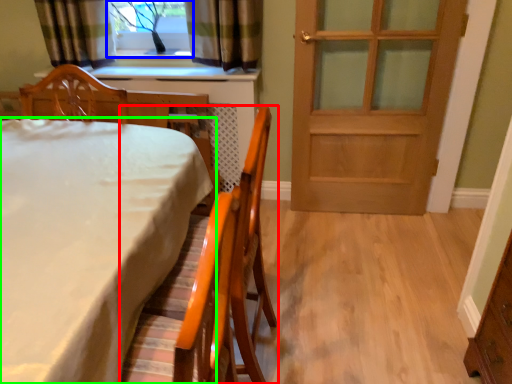
Question: Based on their relative distances, which object is nearer to chair (highlighted by a red box)? Choose from window (highlighted by a blue box) and table (highlighted by a green box).

Choices:
 (A) window
 (B) table

Answer: (B)